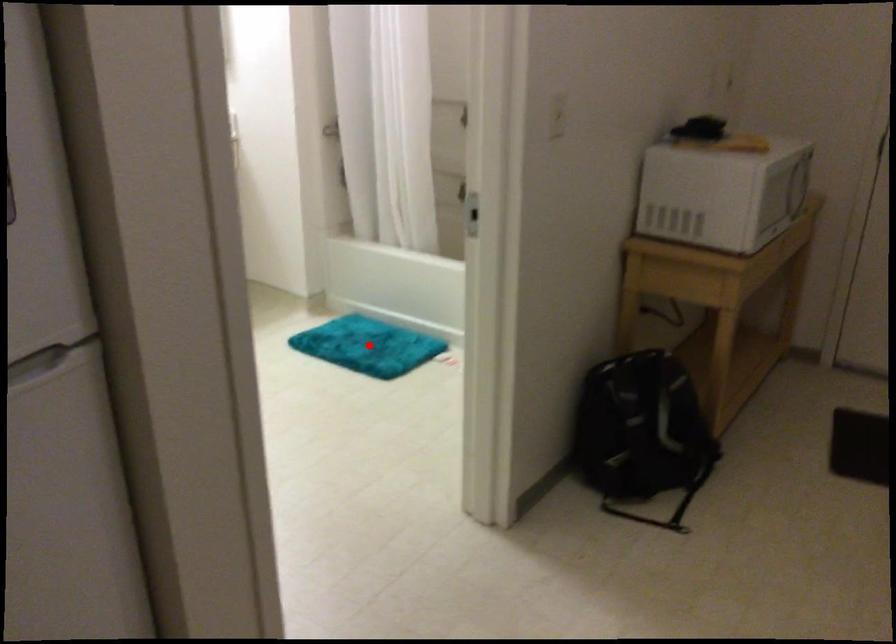
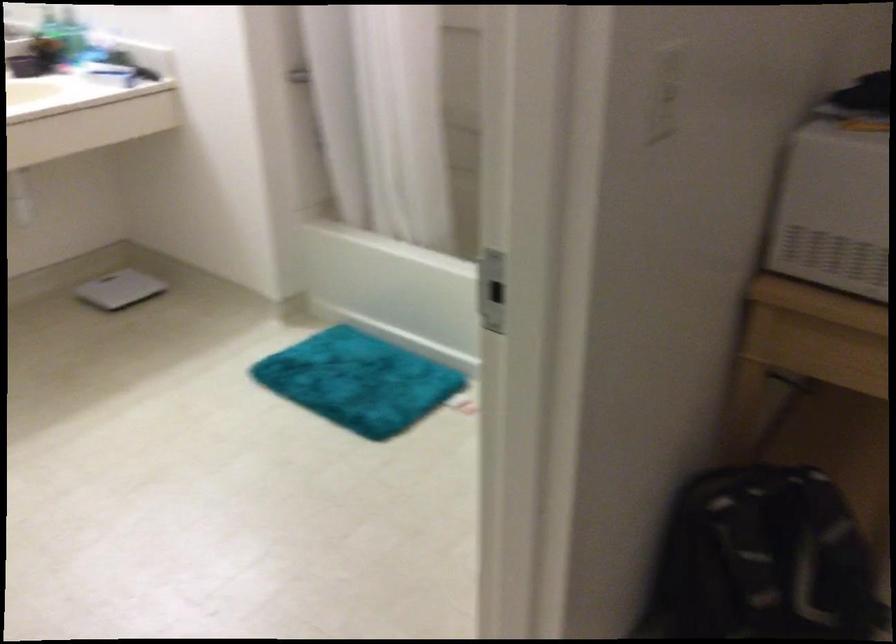
Where in the second image is the point corresponding to the highlighted location from the first image?

(358, 381)